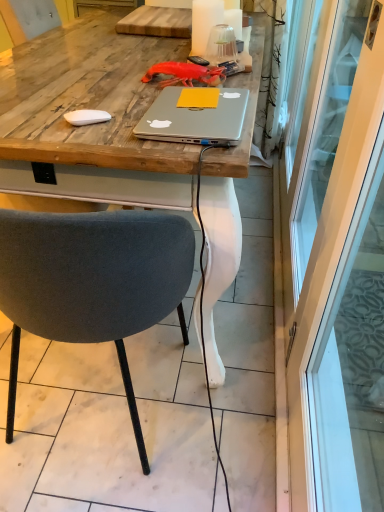
What do you see at coordinates (194, 119) in the screenshot? I see `silver metallic laptop at center` at bounding box center [194, 119].

Measure the distance between silver metallic laptop at center and camera.

The depth of silver metallic laptop at center is 33.03 inches.

Where is `wooden desk at center`? This screenshot has width=384, height=512. wooden desk at center is located at coordinates (92, 125).

Identify the location of transparent glass screen door at right. This screenshot has height=512, width=384. (337, 269).

From a real-world perspective, is transparent glass screen door at right located higher than silver metallic laptop at center?

No, from a real-world perspective, transparent glass screen door at right is not over silver metallic laptop at center

Considering the relative sizes of transparent glass screen door at right and silver metallic laptop at center in the image provided, is transparent glass screen door at right shorter than silver metallic laptop at center?

No.

Considering the relative sizes of transparent glass screen door at right and silver metallic laptop at center in the image provided, is transparent glass screen door at right smaller than silver metallic laptop at center?

Incorrect, transparent glass screen door at right is not smaller in size than silver metallic laptop at center.

From the image's perspective, which is below, transparent glass screen door at right or wooden desk at center?

transparent glass screen door at right, from the image's perspective.

Does transparent glass screen door at right touch wooden desk at center?

They are not placed beside each other.

Find the location of a particular element. The width and height of the screenshot is (384, 512). screen door that is in front of the wooden desk at center is located at coordinates (337, 269).

Is transparent glass screen door at right facing away from wooden desk at center?

That's not correct — transparent glass screen door at right is not looking away from wooden desk at center.

Is transparent glass screen door at right far from velvet grey chair at center?

They are positioned close to each other.

What's the angular difference between transparent glass screen door at right and velvet grey chair at center's facing directions?

89.9 degrees separate the facing orientations of transparent glass screen door at right and velvet grey chair at center.

Is transparent glass screen door at right inside or outside of velvet grey chair at center?

transparent glass screen door at right exists outside the volume of velvet grey chair at center.

Can you confirm if transparent glass screen door at right is taller than velvet grey chair at center?

Yes.

Which object is closer to the camera taking this photo, silver metallic laptop at center or wooden desk at center?

silver metallic laptop at center is closer to the camera.

From a real-world perspective, is silver metallic laptop at center below wooden desk at center?

No, from a real-world perspective, silver metallic laptop at center is not under wooden desk at center.

Measure the distance between silver metallic laptop at center and wooden desk at center.

silver metallic laptop at center and wooden desk at center are 10.93 inches apart.

Is silver metallic laptop at center taller than wooden desk at center?

No.

Considering the sizes of wooden desk at center and velvet grey chair at center in the image, is wooden desk at center wider or thinner than velvet grey chair at center?

Clearly, wooden desk at center has more width compared to velvet grey chair at center.

From the image's perspective, which is below, wooden desk at center or velvet grey chair at center?

velvet grey chair at center, from the image's perspective.

In the image, there is a wooden desk at center. Where is `chair below it (from the image's perspective)`? This screenshot has height=512, width=384. chair below it (from the image's perspective) is located at coordinates (92, 282).

Which object is positioned more to the right, velvet grey chair at center or transparent glass screen door at right?

From the viewer's perspective, transparent glass screen door at right appears more on the right side.

From the image's perspective, is velvet grey chair at center under transparent glass screen door at right?

Correct, velvet grey chair at center appears lower than transparent glass screen door at right in the image.

Looking at this image, measure the distance from velvet grey chair at center to transparent glass screen door at right.

velvet grey chair at center is 24.59 inches from transparent glass screen door at right.

Is velvet grey chair at center taller than transparent glass screen door at right?

Incorrect, the height of velvet grey chair at center is not larger of that of transparent glass screen door at right.

The image size is (384, 512). Identify the location of chair below the silver metallic laptop at center (from a real-world perspective). (92, 282).

Is velvet grey chair at center thinner than silver metallic laptop at center?

In fact, velvet grey chair at center might be wider than silver metallic laptop at center.

Between velvet grey chair at center and silver metallic laptop at center, which one has less height?

silver metallic laptop at center is shorter.

Where is `screen door below the silver metallic laptop at center (from a real-world perspective)`? Image resolution: width=384 pixels, height=512 pixels. screen door below the silver metallic laptop at center (from a real-world perspective) is located at coordinates (337, 269).

Identify the location of screen door located on the right of wooden desk at center. The height and width of the screenshot is (512, 384). (337, 269).

Based on their spatial positions, is transparent glass screen door at right or velvet grey chair at center further from silver metallic laptop at center?

transparent glass screen door at right.

When comparing their distances from velvet grey chair at center, does transparent glass screen door at right or silver metallic laptop at center seem closer?

silver metallic laptop at center lies closer to velvet grey chair at center than the other object.

Based on their spatial positions, is velvet grey chair at center or wooden desk at center further from silver metallic laptop at center?

velvet grey chair at center.

Which object lies nearer to the anchor point velvet grey chair at center, wooden desk at center or silver metallic laptop at center?

silver metallic laptop at center.

Estimate the real-world distances between objects in this image. Which object is further from silver metallic laptop at center, wooden desk at center or velvet grey chair at center?

Among the two, velvet grey chair at center is located further to silver metallic laptop at center.

When comparing their distances from transparent glass screen door at right, does wooden desk at center or velvet grey chair at center seem closer?

wooden desk at center.

Estimate the real-world distances between objects in this image. Which object is further from transparent glass screen door at right, wooden desk at center or silver metallic laptop at center?

silver metallic laptop at center lies further to transparent glass screen door at right than the other object.

From the image, which object appears to be nearer to wooden desk at center, transparent glass screen door at right or silver metallic laptop at center?

Based on the image, silver metallic laptop at center appears to be nearer to wooden desk at center.

What are the coordinates of `laptop between wooden desk at center and velvet grey chair at center vertically` in the screenshot? It's located at (194, 119).

I want to click on laptop between transparent glass screen door at right and wooden desk at center from front to back, so click(194, 119).

The width and height of the screenshot is (384, 512). I want to click on chair positioned between transparent glass screen door at right and silver metallic laptop at center from near to far, so (92, 282).

In order to click on chair between transparent glass screen door at right and wooden desk at center along the z-axis in this screenshot , I will do `click(92, 282)`.